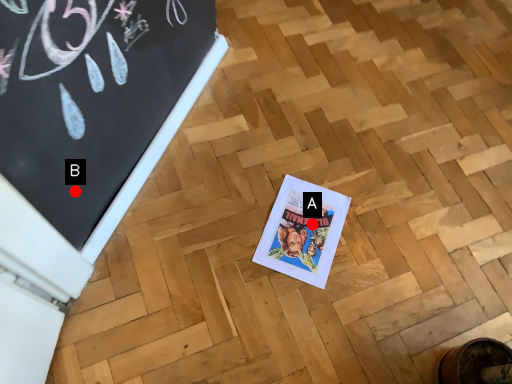
Question: Two points are circled on the image, labeled by A and B beside each circle. Which of the following is the closest to the observer?

Choices:
 (A) A is closer
 (B) B is closer

Answer: (B)